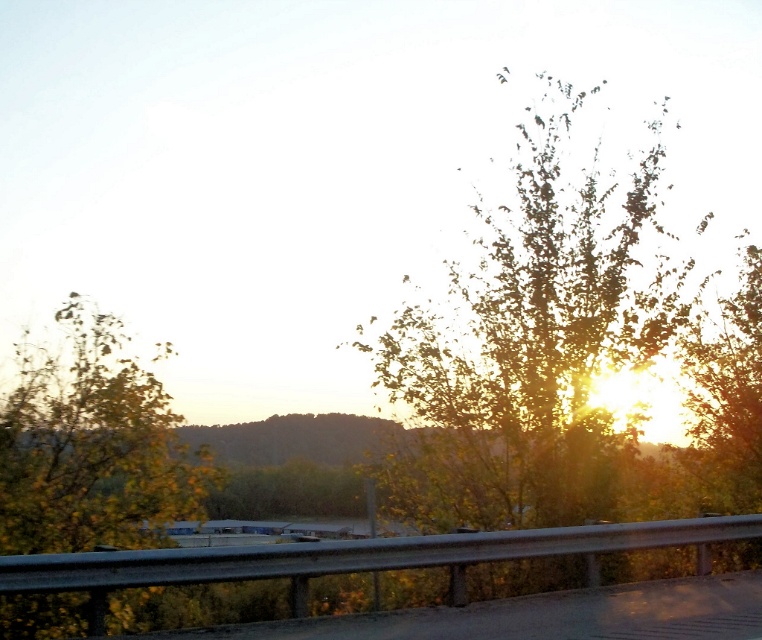
Question: Can you confirm if green leafy tree at center is smaller than green leafy tree at left?

Choices:
 (A) no
 (B) yes

Answer: (A)

Question: Is green leafy tree at center closer to camera compared to green leafy tree at left?

Choices:
 (A) no
 (B) yes

Answer: (A)

Question: Is green leafy tree at center below green leafy tree at left?

Choices:
 (A) yes
 (B) no

Answer: (B)

Question: Which point is farther to the camera?

Choices:
 (A) click(7, 545)
 (B) click(424, 529)

Answer: (B)

Question: Which of the following is the farthest from the observer?

Choices:
 (A) green leafy tree at left
 (B) green leafy tree at center

Answer: (B)